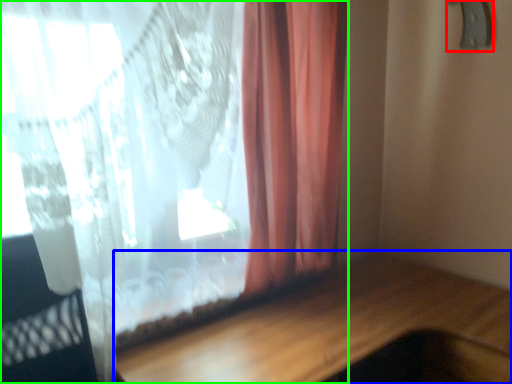
Question: Based on their relative distances, which object is farther from door handle (highlighted by a red box)? Choose from table (highlighted by a blue box) and curtain (highlighted by a green box).

Choices:
 (A) table
 (B) curtain

Answer: (A)